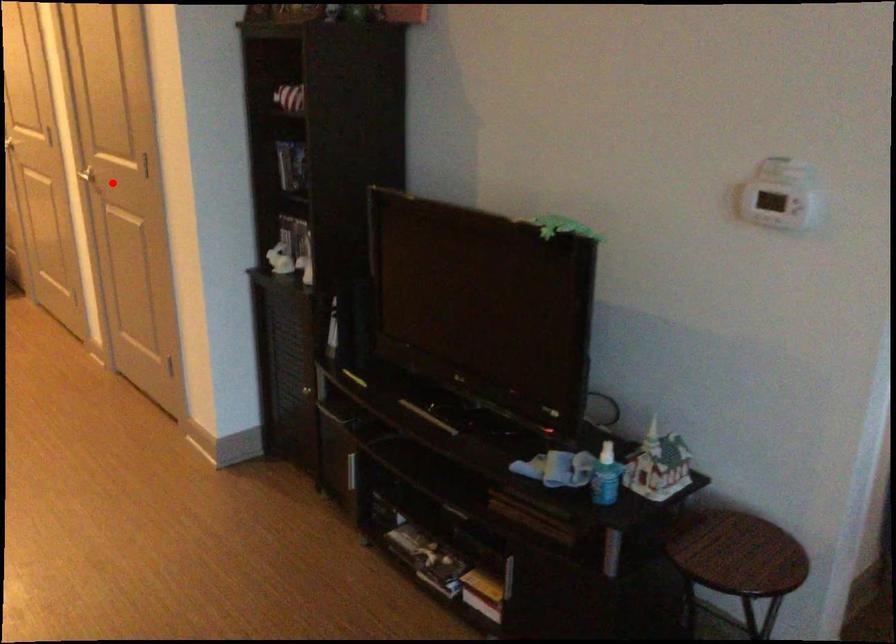
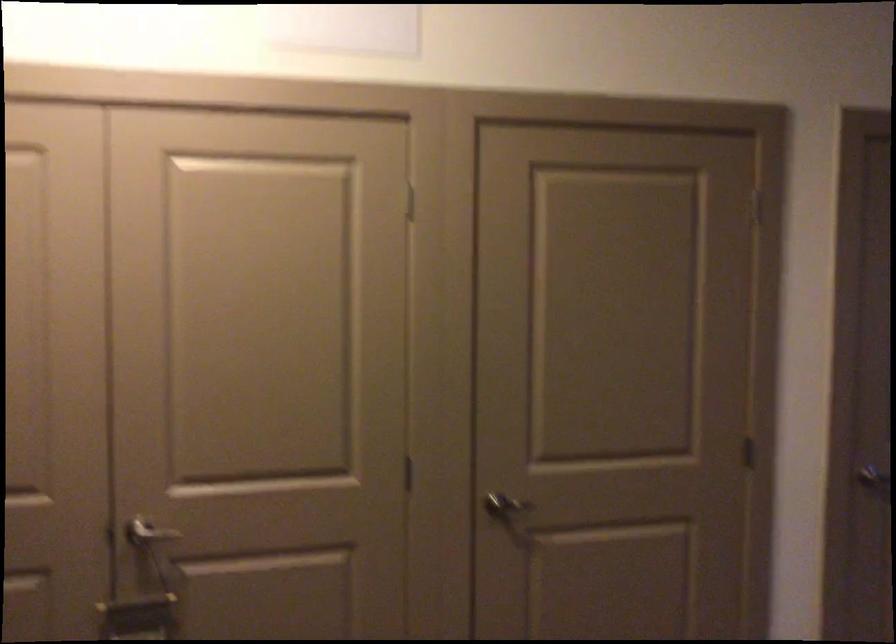
Question: I am providing you with two images of the same scene from different viewpoints. Image1 has a red point marked. In image2, the corresponding 3D location appears at what relative position? Reply with the corresponding letter.

Choices:
 (A) Closer
 (B) Farther

Answer: (A)